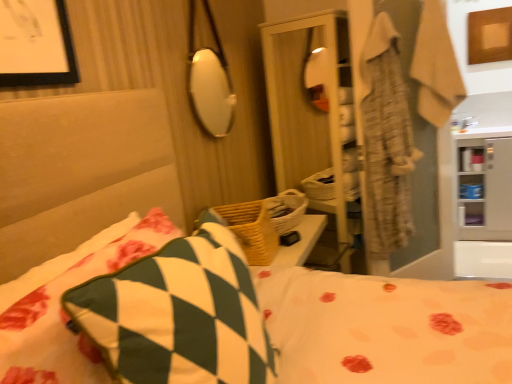
Question: Based on their sizes in the image, would you say wooden picture frame at upper right is bigger or smaller than green and white checkered pillow at center, the 1th pillow in the right-to-left sequence?

Choices:
 (A) big
 (B) small

Answer: (B)

Question: Is wooden picture frame at upper right wider or thinner than green and white checkered pillow at center, the 1th pillow in the right-to-left sequence?

Choices:
 (A) thin
 (B) wide

Answer: (A)

Question: Estimate the real-world distances between objects in this image. Which object is closer to the beige textured robe at upper right?

Choices:
 (A) white glossy cabinet at right
 (B) wooden picture frame at upper right
 (C) green and white checkered pillow at lower left, the 1th pillow viewed from the left
 (D) woven wood basket at center, which is the 1th basket from front to back
 (E) woven wood basket at center, the second basket positioned from the front

Answer: (E)

Question: Which object is the farthest from the green and white checkered pillow at center, which is the second pillow from left to right?

Choices:
 (A) green and white checkered pillow at lower left, which is counted as the 2th pillow, starting from the right
 (B) white glossy cabinet at right
 (C) wooden picture frame at upper right
 (D) woven wood basket at center, placed as the 1th basket when sorted from back to front
 (E) beige textured robe at upper right

Answer: (C)